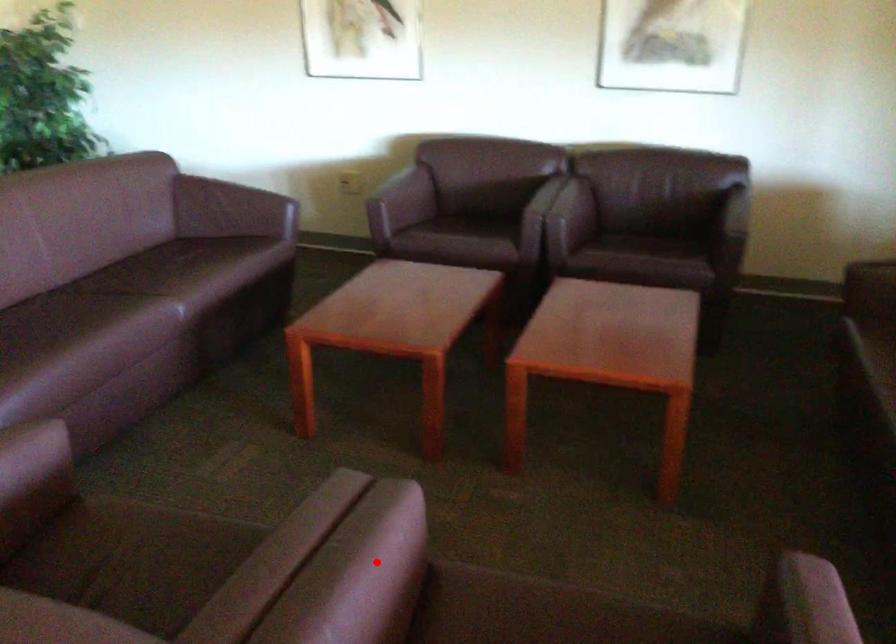
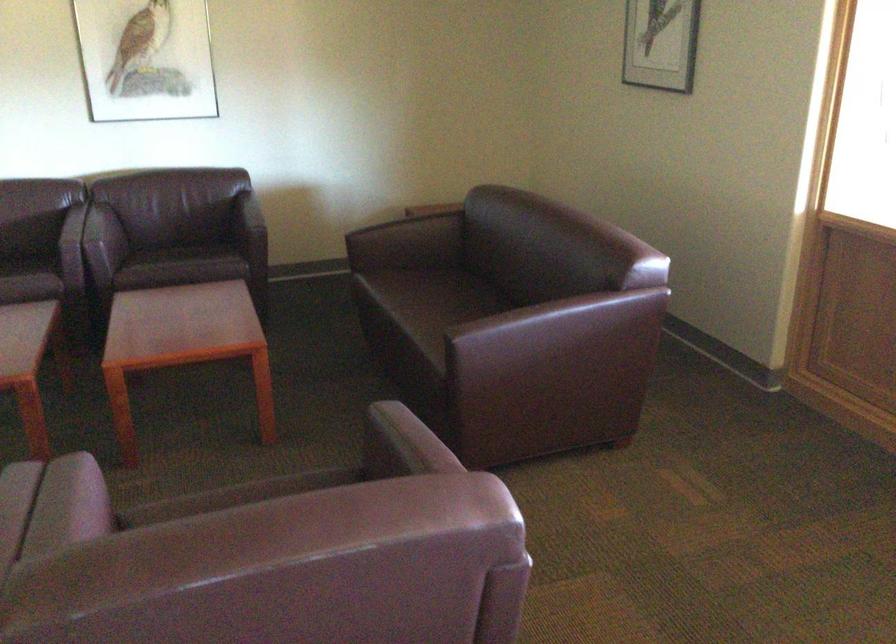
Question: I am providing you with two images of the same scene from different viewpoints. A red point is shown in image1. For the corresponding object point in image2, is it positioned nearer or farther from the camera?

Choices:
 (A) Nearer
 (B) Farther

Answer: (B)